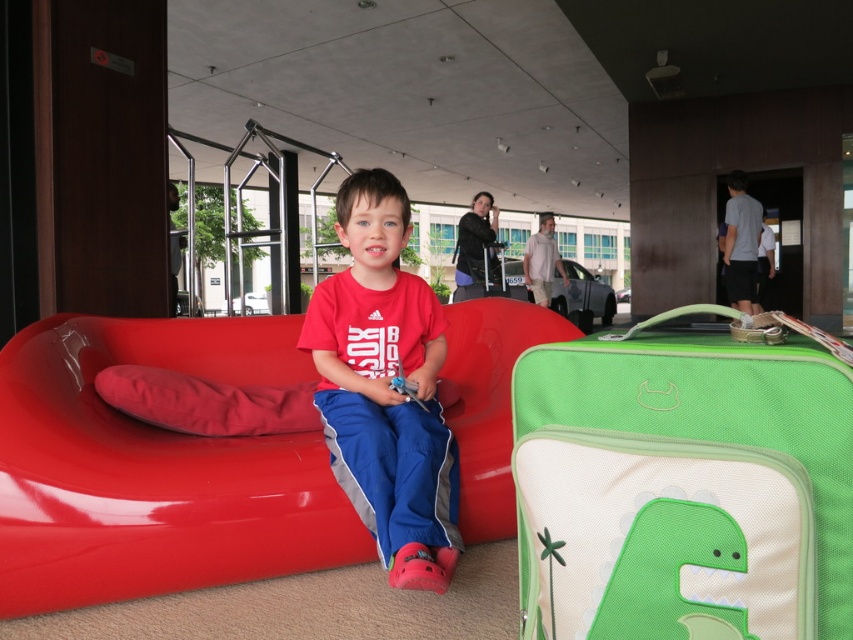
Question: Does matte plastic couch at center have a larger size compared to matte red couch at center?

Choices:
 (A) yes
 (B) no

Answer: (A)

Question: Is green fabric suitcase at center to the right of matte red couch at center from the viewer's perspective?

Choices:
 (A) no
 (B) yes

Answer: (B)

Question: Which object appears closest to the camera in this image?

Choices:
 (A) matte red couch at center
 (B) matte plastic couch at center

Answer: (A)

Question: Which point is closer to the camera?

Choices:
 (A) matte plastic couch at center
 (B) matte red couch at center
 (C) green fabric suitcase at center

Answer: (C)

Question: Is green fabric suitcase at center positioned in front of matte red couch at center?

Choices:
 (A) no
 (B) yes

Answer: (B)

Question: Which object is the farthest from the matte plastic couch at center?

Choices:
 (A) green fabric suitcase at center
 (B) matte red couch at center

Answer: (A)